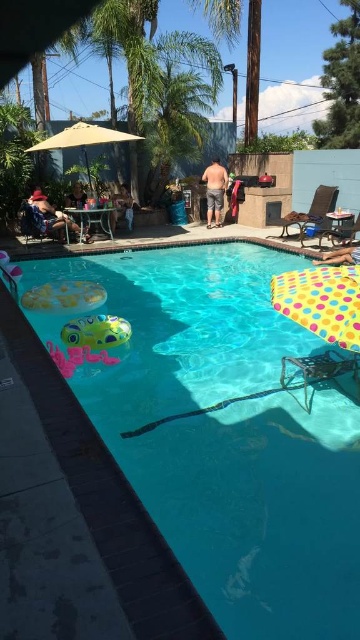
Locate an element on the screen. This screenshot has width=360, height=640. metallic silver chair at lower right is located at coordinates point(318,371).

Which is more to the right, metallic silver chair at lower right or matte black sunglasses at lower left?

From the viewer's perspective, metallic silver chair at lower right appears more on the right side.

This screenshot has height=640, width=360. Find the location of `metallic silver chair at lower right`. metallic silver chair at lower right is located at coordinates (318, 371).

The height and width of the screenshot is (640, 360). Identify the location of metallic silver chair at lower right. (318, 371).

Between brown woven chair at upper right and smooth tan skin at lower right, which one appears on the left side from the viewer's perspective?

Positioned to the left is smooth tan skin at lower right.

Based on the photo, can you confirm if brown woven chair at upper right is positioned to the right of smooth tan skin at lower right?

Yes, brown woven chair at upper right is to the right of smooth tan skin at lower right.

Does point (303, 227) come farther from viewer compared to point (358, 250)?

Yes, it is behind point (358, 250).

You are a GUI agent. You are given a task and a screenshot of the screen. Output one action in this format:
    pyautogui.click(x=<x>, y=<y>)
    Task: Click on the brown woven chair at upper right
    The height and width of the screenshot is (640, 360).
    Given the screenshot: What is the action you would take?
    pyautogui.click(x=312, y=212)

Between tan skin person at center and smooth tan skin at lower right, which one has less height?

With less height is smooth tan skin at lower right.

Consider the image. Is tan skin person at center below smooth tan skin at lower right?

No, tan skin person at center is not below smooth tan skin at lower right.

Who is more distant from viewer, (218,179) or (336,260)?

Positioned behind is point (218,179).

Locate an element on the screen. tan skin person at center is located at coordinates (214, 189).